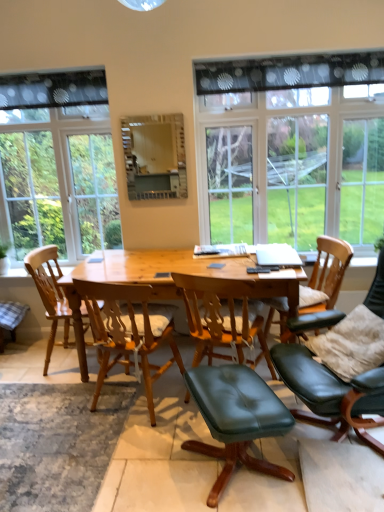
Question: From the image's perspective, does black leather chair at right, the 4th chair from the left, appear lower than natural wood table at center?

Choices:
 (A) yes
 (B) no

Answer: (A)

Question: Considering the relative sizes of black leather chair at right, the 1th chair in the right-to-left sequence, and natural wood table at center in the image provided, is black leather chair at right, the 1th chair in the right-to-left sequence, smaller than natural wood table at center?

Choices:
 (A) no
 (B) yes

Answer: (B)

Question: Is black leather chair at right, the 4th chair from the left, closer to the viewer compared to natural wood table at center?

Choices:
 (A) yes
 (B) no

Answer: (A)

Question: Is black leather chair at right, the 1th chair in the right-to-left sequence, positioned with its back to natural wood table at center?

Choices:
 (A) yes
 (B) no

Answer: (B)

Question: From a real-world perspective, is black leather chair at right, the 1th chair in the right-to-left sequence, over natural wood table at center?

Choices:
 (A) yes
 (B) no

Answer: (A)

Question: From a real-world perspective, is black leather chair at right, the 1th chair in the right-to-left sequence, beneath natural wood table at center?

Choices:
 (A) yes
 (B) no

Answer: (B)

Question: Does transparent glass window at upper center, the first window positioned from the right, have a lesser height compared to wooden chair at left, the 1th chair from the left?

Choices:
 (A) no
 (B) yes

Answer: (A)

Question: From the image's perspective, is transparent glass window at upper center, the first window positioned from the right, above wooden chair at left, the 1th chair from the left?

Choices:
 (A) yes
 (B) no

Answer: (A)

Question: Is transparent glass window at upper center, which is the 2th window from left to right, completely or partially outside of wooden chair at left, the 1th chair from the left?

Choices:
 (A) yes
 (B) no

Answer: (A)

Question: Is transparent glass window at upper center, the first window positioned from the right, not near wooden chair at left, the 1th chair from the left?

Choices:
 (A) yes
 (B) no

Answer: (A)

Question: Is transparent glass window at upper center, which is the 2th window from left to right, thinner than wooden chair at left, which is the 4th chair in right-to-left order?

Choices:
 (A) yes
 (B) no

Answer: (A)

Question: Is wooden chair at left, which is the 4th chair in right-to-left order, at the back of transparent glass window at upper center, the first window positioned from the right?

Choices:
 (A) no
 (B) yes

Answer: (A)

Question: Would you consider clear glass window at left, placed as the second window when sorted from right to left, to be distant from black leather chair at right, the 4th chair from the left?

Choices:
 (A) no
 (B) yes

Answer: (B)